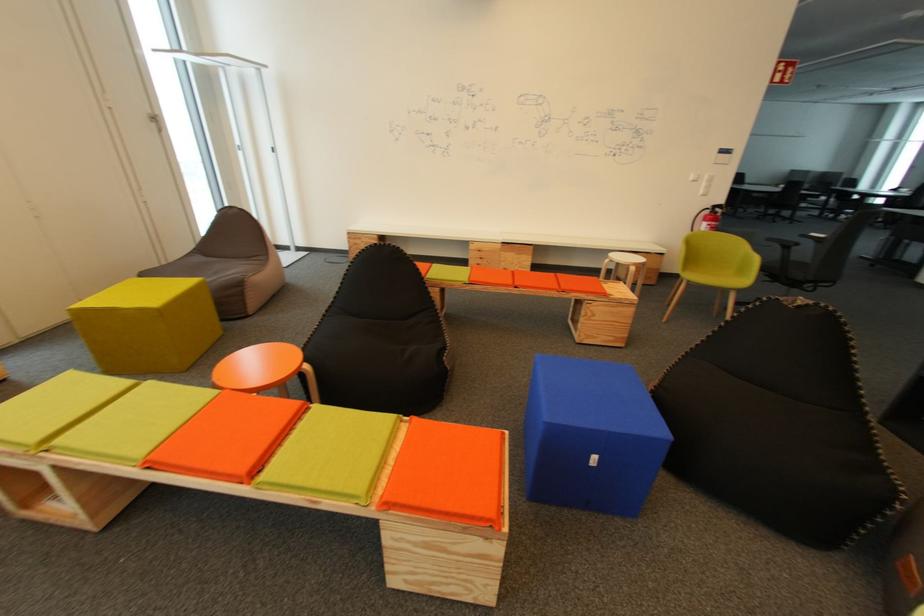
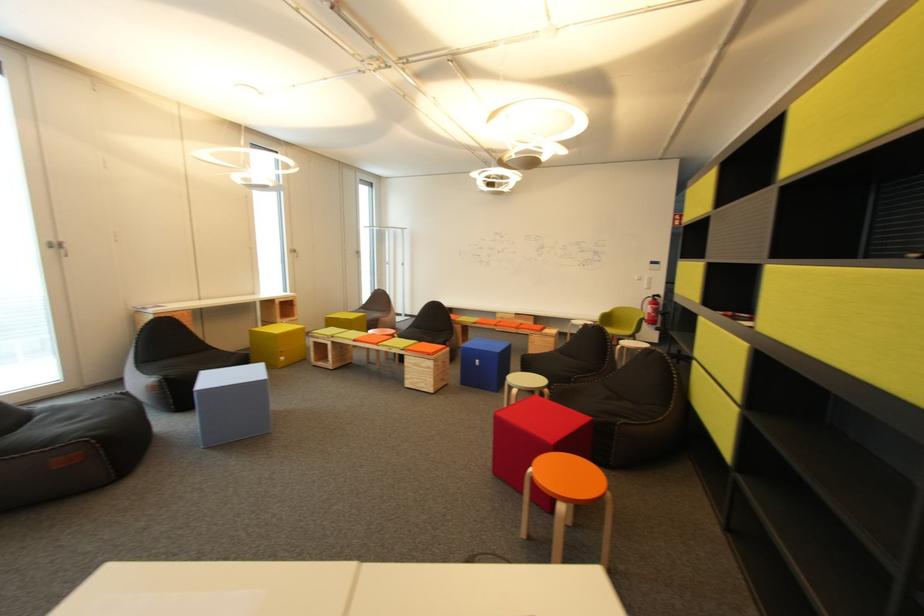
The images are taken continuously from a first-person perspective. In which direction are you moving?

The cameraman walked toward right, backward.